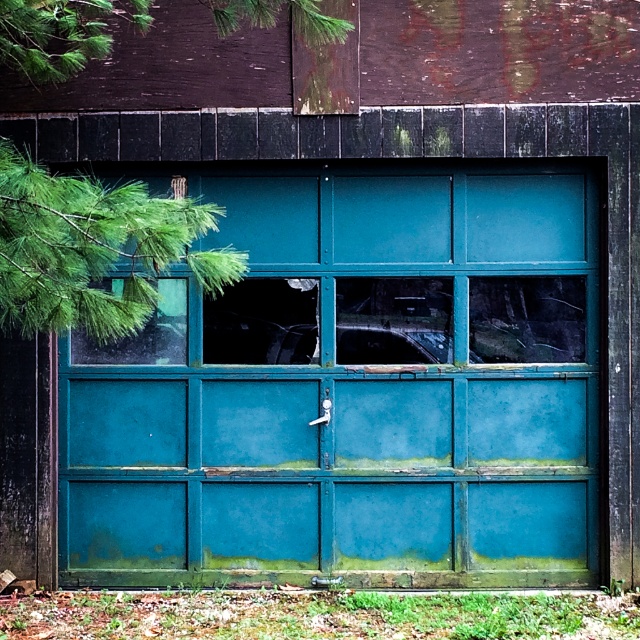
Does point (336, 32) lie behind point (364, 353)?

No.

Between green leafy branch at upper left and teal matte window at center, which one has less height?

With less height is teal matte window at center.

Between point (205, 268) and point (445, 358), which one is positioned behind?

The point (445, 358) is behind.

The width and height of the screenshot is (640, 640). Identify the location of green leafy branch at upper left. (92, 250).

Who is taller, teal painted wood garage door at center or teal glass window at upper left?

teal painted wood garage door at center

Is teal painted wood garage door at center thinner than teal glass window at upper left?

No.

Image resolution: width=640 pixels, height=640 pixels. What are the coordinates of `teal painted wood garage door at center` in the screenshot? It's located at (355, 392).

Where is `teal painted wood garage door at center`? Image resolution: width=640 pixels, height=640 pixels. teal painted wood garage door at center is located at coordinates 355,392.

Is teal painted wood garage door at center to the right of green leafy branch at upper left from the viewer's perspective?

Indeed, teal painted wood garage door at center is positioned on the right side of green leafy branch at upper left.

Looking at this image, is teal painted wood garage door at center below green leafy branch at upper left?

Yes.

Does point (305, 224) come closer to viewer compared to point (29, 49)?

No.

Identify the location of teal painted wood garage door at center. (355, 392).